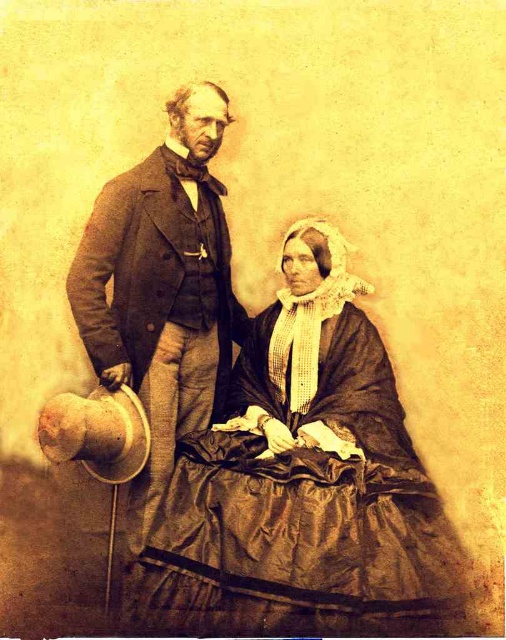
Which of these two, matte black dress at center or matte brown suit at upper left, stands shorter?

Standing shorter between the two is matte black dress at center.

Is matte black dress at center closer to the viewer compared to matte brown suit at upper left?

Yes.

Describe the element at coordinates (303, 481) in the screenshot. Image resolution: width=506 pixels, height=640 pixels. I see `matte black dress at center` at that location.

At what (x,y) coordinates should I click in order to perform the action: click on matte black dress at center. Please return your answer as a coordinate pair (x, y). The height and width of the screenshot is (640, 506). Looking at the image, I should click on (303, 481).